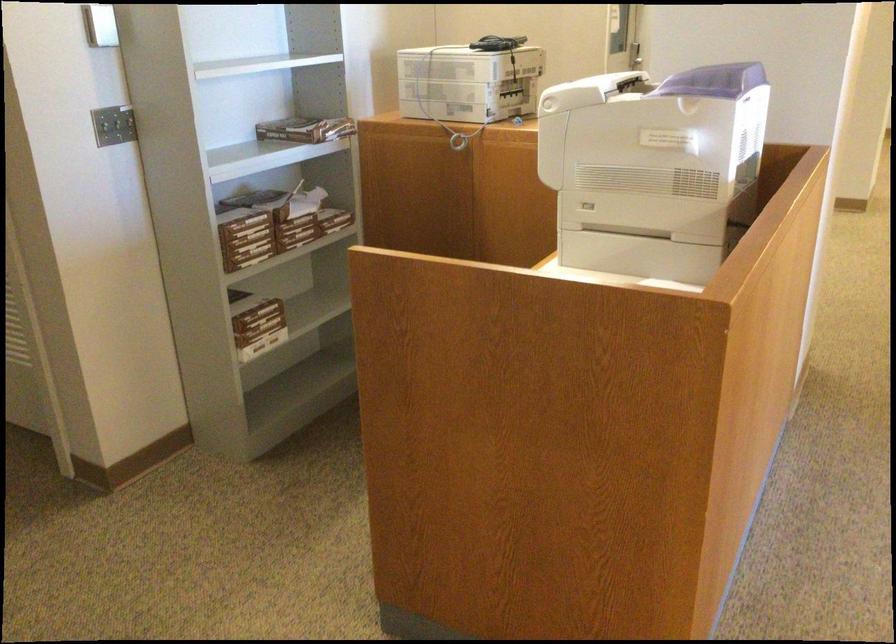
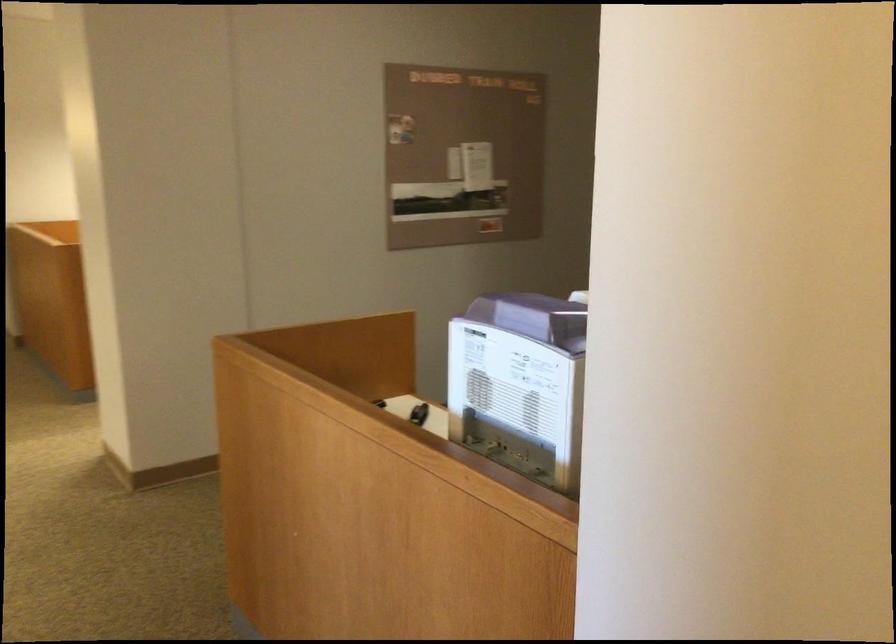
Question: I am providing you with two images of the same scene from different viewpoints. Which of the following objects are not visible in image2?

Choices:
 (A) ream of paper
 (B) small black object
 (C) pink plastic cup
 (D) purple machine lid

Answer: (A)